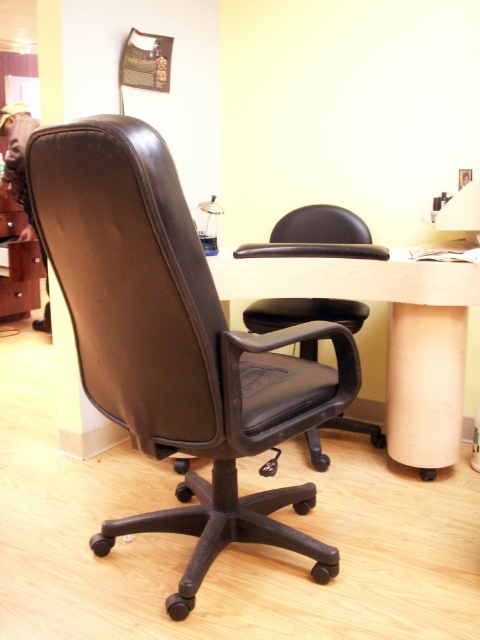
You are an office worker who needs to move a box from the floor to the desk. The box is currently near the black leather office chair at center. Can you place the box on the light wood computer desk at center without moving the chair?

The black leather office chair at center is located above the light wood computer desk at center, so the box can be placed on the desk by moving it under the chair since the chair is positioned above the desk.

You are standing in the office and want to place a new plant pot between the two points, point (397, 454) and point (10, 257). Since the plant pot needs to be closer to the viewer, which point should you position it near?

Point (397, 454) is closer to the viewer than point (10, 257), so you should position the plant pot near point (397, 454) to ensure it is closer to the viewer.

From the picture: You are organizing a meeting in the office and need to place a laptop on the desk. The matte brown drawer at left has some cables that need to be plugged into the laptop. Can you reach the cables from the black leather office chair at center without moving the chair?

The black leather office chair at center is located below the matte brown drawer at left, so you can reach the cables from the chair by simply extending your arm upwards towards the drawer.